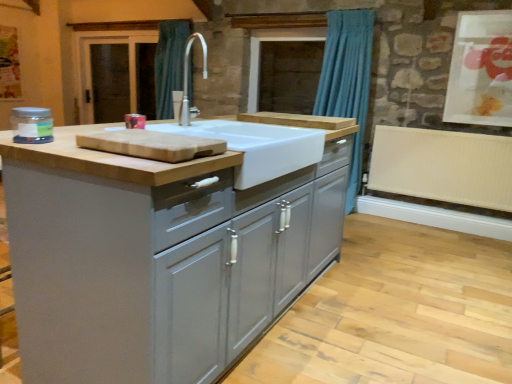
Where is `vacant space to the right of matte gray cabinets at center`? Image resolution: width=512 pixels, height=384 pixels. vacant space to the right of matte gray cabinets at center is located at coordinates [391, 311].